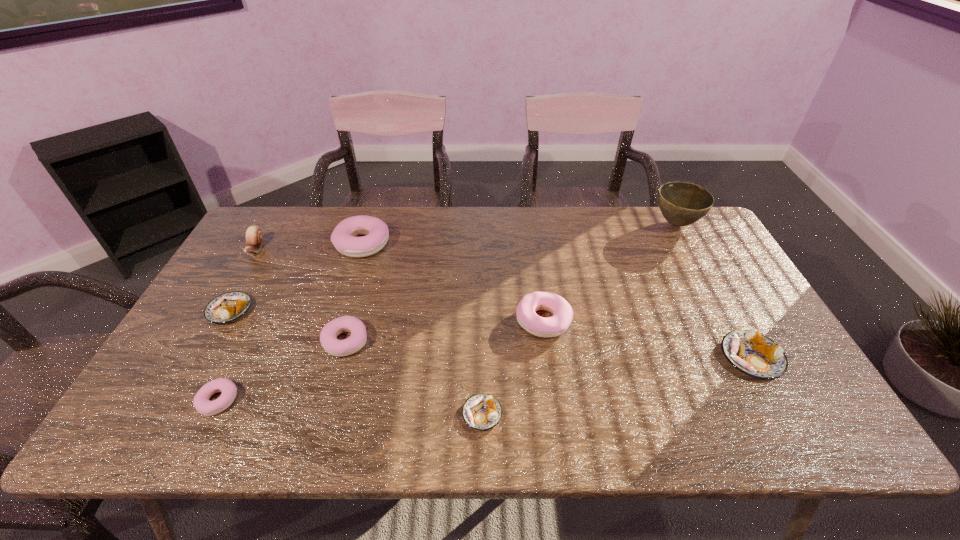
The width and height of the screenshot is (960, 540). I want to click on vacant position located 0.170m on the left of the rightmost brown pastry, so click(653, 357).

Where is `free spot located on the front of the second smallest pink pastry`? free spot located on the front of the second smallest pink pastry is located at coordinates (329, 399).

Locate an element on the screen. The width and height of the screenshot is (960, 540). vacant space situated 0.050m on the front of the farthest brown pastry is located at coordinates 212,342.

Identify the location of vacant space situated on the right of the leftmost pink pastry. The height and width of the screenshot is (540, 960). (303, 400).

Locate an element on the screen. free space located 0.220m on the right of the fourth object from right to left is located at coordinates (601, 414).

Locate an element on the screen. This screenshot has width=960, height=540. bowl that is at the far edge is located at coordinates (681, 203).

Identify the location of escargot that is at the far edge. (254, 238).

You are a GUI agent. You are given a task and a screenshot of the screen. Output one action in this format:
    pyautogui.click(x=<x>, y=<y>)
    Task: Click on the pastry that is at the far edge
    Image resolution: width=960 pixels, height=540 pixels.
    Given the screenshot: What is the action you would take?
    pyautogui.click(x=343, y=237)

Where is `escargot at the left edge`? This screenshot has height=540, width=960. escargot at the left edge is located at coordinates (254, 238).

Identify the location of bowl positioned at the right edge. (681, 203).